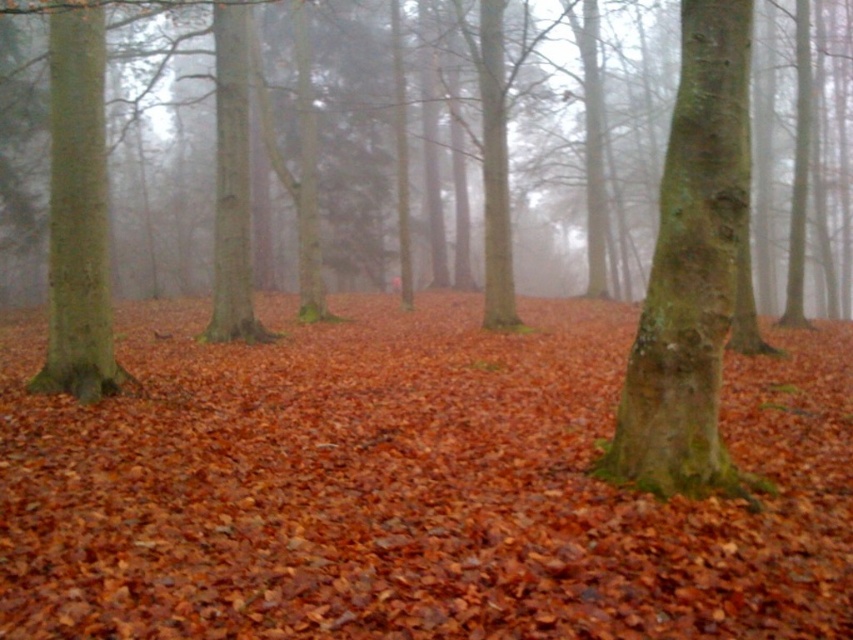
Is point (444, 412) farther from camera compared to point (732, 294)?

Yes.

Looking at this image, which is above, leaves at center or green rough bark tree at center?

leaves at center is above.

Does point (791, 385) come in front of point (718, 13)?

No.

Where is `leaves at center`? The width and height of the screenshot is (853, 640). leaves at center is located at coordinates (409, 486).

Find the location of a particular element. leaves at center is located at coordinates (409, 486).

Does leaves at center have a greater width compared to green rough bark tree at left?

Correct, the width of leaves at center exceeds that of green rough bark tree at left.

Between point (585, 483) and point (97, 179), which one is positioned behind?

Positioned behind is point (97, 179).

Locate an element on the screen. leaves at center is located at coordinates (409, 486).

Looking at this image, can you confirm if green rough bark tree at center is positioned below green rough bark tree at left?

Correct, green rough bark tree at center is located below green rough bark tree at left.

Is green rough bark tree at center above green rough bark tree at left?

No, green rough bark tree at center is not above green rough bark tree at left.

Where is `green rough bark tree at center`? The width and height of the screenshot is (853, 640). green rough bark tree at center is located at coordinates (691, 272).

In order to click on green rough bark tree at center in this screenshot , I will do `click(691, 272)`.